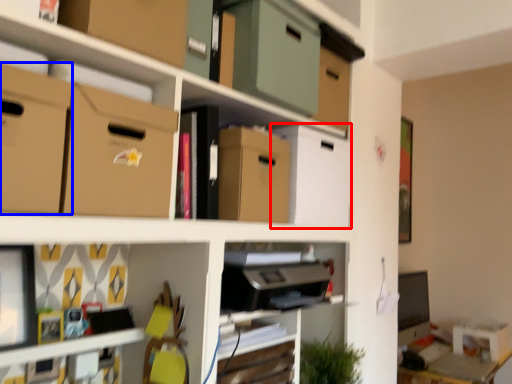
Question: Which object is further to the camera taking this photo, storage box (highlighted by a red box) or cardboard box (highlighted by a blue box)?

Choices:
 (A) storage box
 (B) cardboard box

Answer: (A)